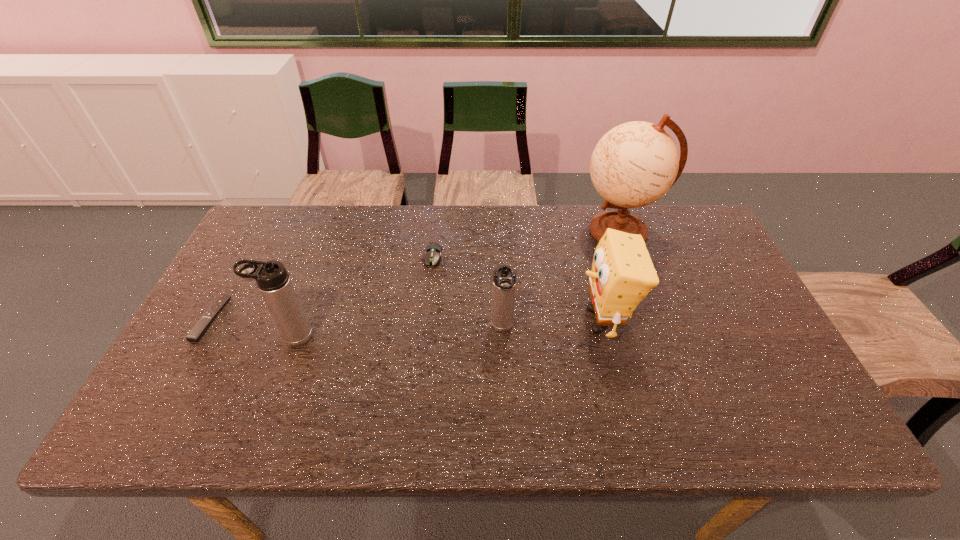
Find the location of a particular element. This screenshot has height=540, width=960. vacant region located 0.140m on the handle side of the second object from left to right is located at coordinates (215, 336).

Where is `vacant space located 0.170m on the handle side of the second object from left to right`? Image resolution: width=960 pixels, height=540 pixels. vacant space located 0.170m on the handle side of the second object from left to right is located at coordinates (204, 336).

Identify the location of free region located 0.140m on the handle side of the second object from left to right. Image resolution: width=960 pixels, height=540 pixels. (215, 336).

Find the location of a particular element. Image resolution: width=960 pixels, height=540 pixels. free space located 0.160m on the handle side of the shorter thermos bottle is located at coordinates (506, 400).

This screenshot has height=540, width=960. I want to click on vacant area located on the surface of the globe, so click(560, 231).

The height and width of the screenshot is (540, 960). What are the coordinates of `vacant space located on the surface of the globe` in the screenshot? It's located at tap(455, 231).

Identify the location of free region located 0.290m on the surface of the globe. This screenshot has width=960, height=540. (489, 231).

Where is `free space located on the left of the third object from left to right`? This screenshot has width=960, height=540. free space located on the left of the third object from left to right is located at coordinates (389, 258).

This screenshot has height=540, width=960. In order to click on vacant position located 0.070m on the back of the remote control in this screenshot , I will do `click(233, 279)`.

The height and width of the screenshot is (540, 960). Find the location of `free spot located on the face of the sponge`. free spot located on the face of the sponge is located at coordinates (522, 320).